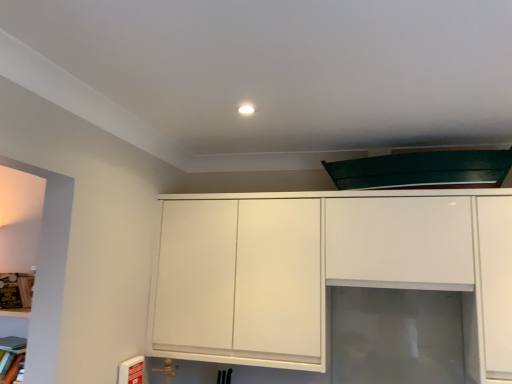
Question: Does white glossy cabinet at center have a greater height compared to wooden bookshelf at left?

Choices:
 (A) no
 (B) yes

Answer: (B)

Question: Considering the relative positions of white glossy cabinet at center and wooden bookshelf at left in the image provided, is white glossy cabinet at center to the left of wooden bookshelf at left from the viewer's perspective?

Choices:
 (A) no
 (B) yes

Answer: (A)

Question: Is white glossy cabinet at center shorter than wooden bookshelf at left?

Choices:
 (A) no
 (B) yes

Answer: (A)

Question: Can you confirm if white glossy cabinet at center is smaller than wooden bookshelf at left?

Choices:
 (A) yes
 (B) no

Answer: (B)

Question: Can you confirm if white glossy cabinet at center is positioned to the right of wooden bookshelf at left?

Choices:
 (A) no
 (B) yes

Answer: (B)

Question: In terms of width, does wooden bookshelf at left look wider or thinner when compared to transparent glass door at center?

Choices:
 (A) wide
 (B) thin

Answer: (A)

Question: Would you say wooden bookshelf at left is to the left or to the right of transparent glass door at center in the picture?

Choices:
 (A) right
 (B) left

Answer: (B)

Question: From a real-world perspective, is wooden bookshelf at left physically located above or below transparent glass door at center?

Choices:
 (A) above
 (B) below

Answer: (A)

Question: Does point (17, 279) appear closer or farther from the camera than point (394, 312)?

Choices:
 (A) farther
 (B) closer

Answer: (B)

Question: From a real-world perspective, is transparent glass door at center above or below white glossy cabinet at center?

Choices:
 (A) above
 (B) below

Answer: (B)

Question: Considering the positions of transparent glass door at center and white glossy cabinet at center in the image, is transparent glass door at center taller or shorter than white glossy cabinet at center?

Choices:
 (A) tall
 (B) short

Answer: (B)

Question: Relative to white glossy cabinet at center, is transparent glass door at center in front or behind?

Choices:
 (A) front
 (B) behind

Answer: (B)

Question: From the image's perspective, is transparent glass door at center positioned above or below white glossy cabinet at center?

Choices:
 (A) above
 (B) below

Answer: (B)

Question: Based on their sizes in the image, would you say white glossy cabinet at center is bigger or smaller than transparent glass door at center?

Choices:
 (A) big
 (B) small

Answer: (A)

Question: In terms of height, does white glossy cabinet at center look taller or shorter compared to transparent glass door at center?

Choices:
 (A) tall
 (B) short

Answer: (A)